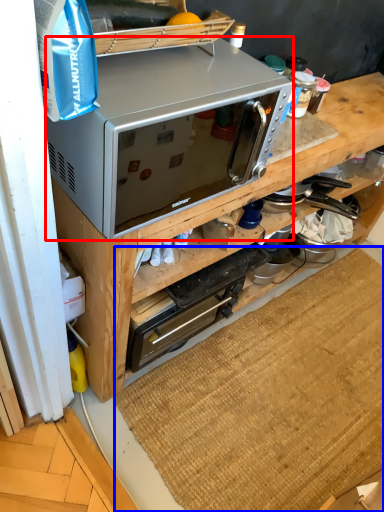
Question: Which object appears closest to the camera in this image, microwave oven (highlighted by a red box) or doormat (highlighted by a blue box)?

Choices:
 (A) microwave oven
 (B) doormat

Answer: (A)